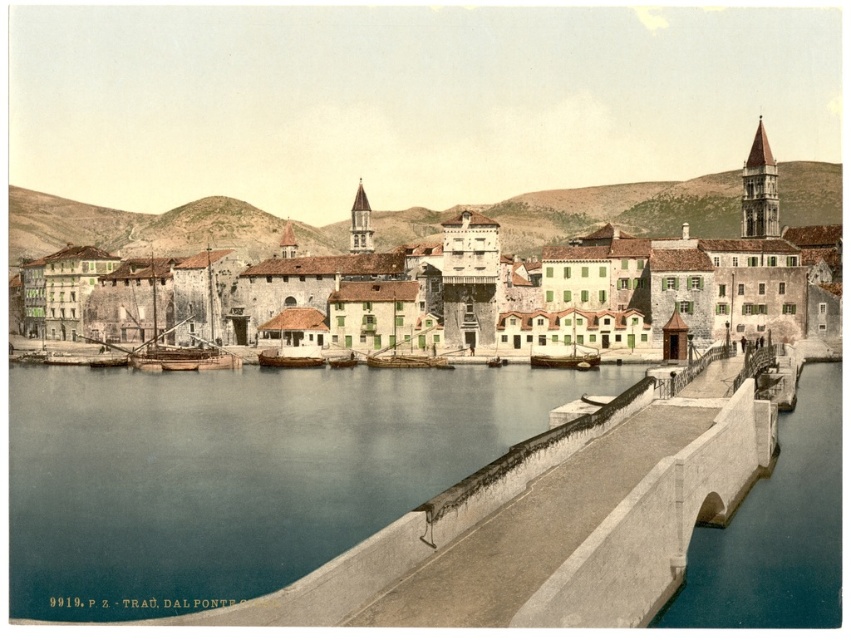
Which is below, blue water at lower left or wooden boat at center?

blue water at lower left

Does blue water at lower left have a lesser width compared to wooden boat at center?

No, blue water at lower left is not thinner than wooden boat at center.

Is point (109, 474) positioned after point (563, 364)?

No.

Locate an element on the screen. blue water at lower left is located at coordinates (238, 472).

Is blue water at lower left below stone buildings at center?

Yes, blue water at lower left is below stone buildings at center.

Does blue water at lower left have a greater width compared to stone buildings at center?

No.

Is point (277, 540) closer to camera compared to point (152, 234)?

Yes.

Identify the location of blue water at lower left. (238, 472).

Is point (700, 202) closer to camera compared to point (560, 353)?

No, it is not.

I want to click on stone buildings at center, so click(x=136, y=227).

Where is `stone buildings at center`? This screenshot has height=640, width=851. stone buildings at center is located at coordinates (136, 227).